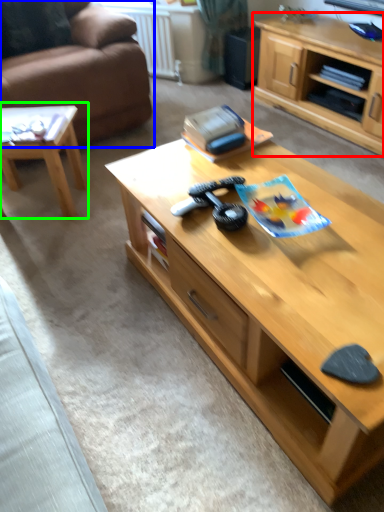
Question: Which object is positioned closest to cabinetry (highlighted by a red box)? Select from studio couch (highlighted by a blue box) and coffee table (highlighted by a green box).

Choices:
 (A) studio couch
 (B) coffee table

Answer: (A)